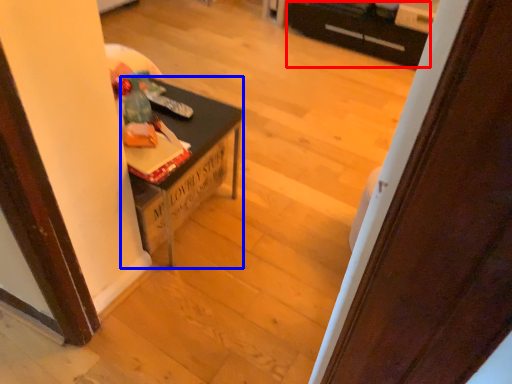
Question: Which point is further to the camera, drawer (highlighted by a red box) or table (highlighted by a blue box)?

Choices:
 (A) drawer
 (B) table

Answer: (A)